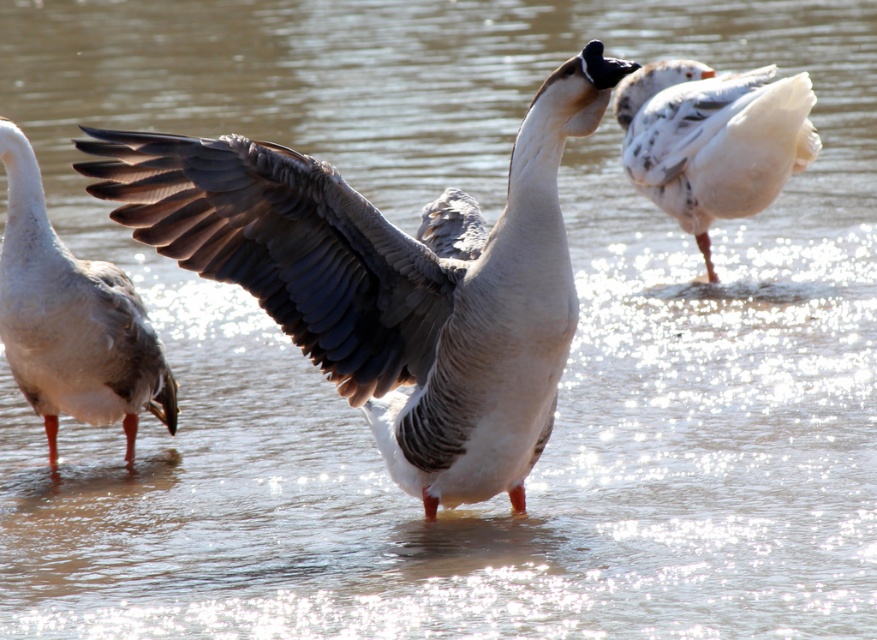
Question: Does gray feathered wing at center have a lesser width compared to white matte duck at left?

Choices:
 (A) no
 (B) yes

Answer: (A)

Question: Where is gray feathered wing at center located in relation to white fluffy duck at upper right in the image?

Choices:
 (A) right
 (B) left

Answer: (B)

Question: Which object is closer to the camera taking this photo?

Choices:
 (A) white matte duck at left
 (B) white fluffy duck at upper right

Answer: (A)

Question: Can you confirm if gray feathered goose at center is positioned below white fluffy duck at upper right?

Choices:
 (A) no
 (B) yes

Answer: (B)

Question: Which object is the closest to the white matte duck at left?

Choices:
 (A) gray feathered wing at center
 (B) white fluffy duck at upper right

Answer: (A)

Question: Which object appears closest to the camera in this image?

Choices:
 (A) white matte duck at left
 (B) gray feathered wing at center
 (C) white fluffy duck at upper right
 (D) gray feathered goose at center

Answer: (D)